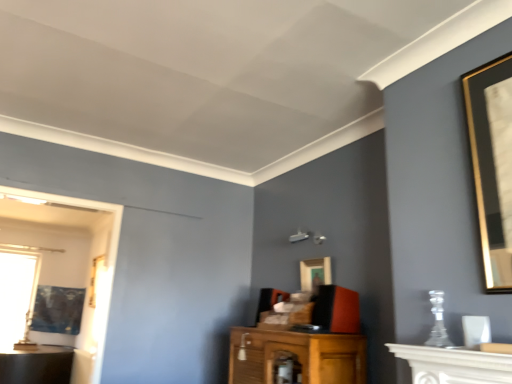
Question: Considering the relative sizes of transparent glass window at left and white marble fireplace at lower right in the image provided, is transparent glass window at left wider than white marble fireplace at lower right?

Choices:
 (A) no
 (B) yes

Answer: (A)

Question: From a real-world perspective, is transparent glass window at left on white marble fireplace at lower right?

Choices:
 (A) no
 (B) yes

Answer: (A)

Question: Considering the relative sizes of transparent glass window at left and white marble fireplace at lower right in the image provided, is transparent glass window at left bigger than white marble fireplace at lower right?

Choices:
 (A) no
 (B) yes

Answer: (B)

Question: Can you confirm if transparent glass window at left is shorter than white marble fireplace at lower right?

Choices:
 (A) no
 (B) yes

Answer: (A)

Question: Is transparent glass window at left outside white marble fireplace at lower right?

Choices:
 (A) yes
 (B) no

Answer: (A)

Question: Does transparent glass window at left turn towards white marble fireplace at lower right?

Choices:
 (A) yes
 (B) no

Answer: (A)

Question: Considering the relative sizes of gold-framed picture at left, which is the 2th picture frame from right to left, and white marble fireplace at lower right in the image provided, is gold-framed picture at left, which is the 2th picture frame from right to left, smaller than white marble fireplace at lower right?

Choices:
 (A) yes
 (B) no

Answer: (B)

Question: From a real-world perspective, is gold-framed picture at left, which ranks as the second picture frame in back-to-front order, beneath white marble fireplace at lower right?

Choices:
 (A) yes
 (B) no

Answer: (B)

Question: Can you confirm if gold-framed picture at left, which is the 2th picture frame from right to left, is shorter than white marble fireplace at lower right?

Choices:
 (A) yes
 (B) no

Answer: (B)

Question: Is gold-framed picture at left, which is the 2th picture frame from right to left, with white marble fireplace at lower right?

Choices:
 (A) no
 (B) yes

Answer: (A)

Question: Can you confirm if gold-framed picture at left, the second picture frame from the top, is thinner than white marble fireplace at lower right?

Choices:
 (A) no
 (B) yes

Answer: (B)

Question: Is gold-framed picture at left, the second picture frame positioned from the left, far away from white marble fireplace at lower right?

Choices:
 (A) yes
 (B) no

Answer: (A)

Question: Is white marble fireplace at lower right smaller than gold-framed picture at center, the 1th picture frame in the right-to-left sequence?

Choices:
 (A) yes
 (B) no

Answer: (B)